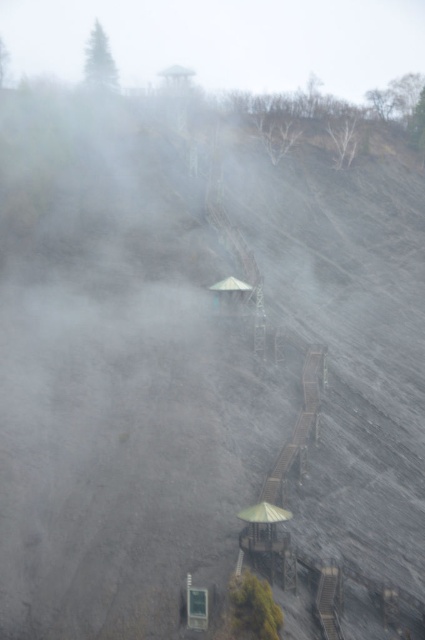
Question: Is foggy gray cloud at upper center positioned at the back of metallic gray hut at center?

Choices:
 (A) no
 (B) yes

Answer: (B)

Question: Which point is closer to the camera?

Choices:
 (A) metallic gray hut at center
 (B) foggy gray cloud at upper center

Answer: (A)

Question: Is foggy gray cloud at upper center bigger than metallic gray hut at center?

Choices:
 (A) no
 (B) yes

Answer: (B)

Question: Can you confirm if foggy gray cloud at upper center is smaller than metallic gray hut at center?

Choices:
 (A) no
 (B) yes

Answer: (A)

Question: Which point is closer to the camera?

Choices:
 (A) click(x=218, y=292)
 (B) click(x=357, y=17)

Answer: (A)